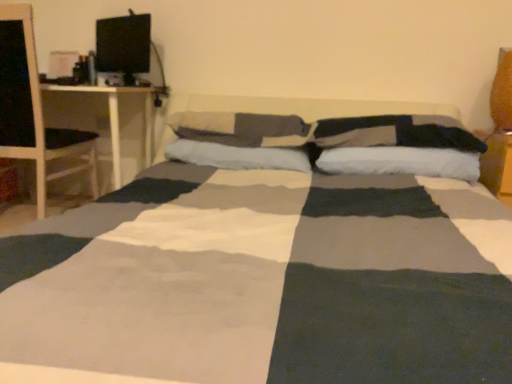
Question: Is white soft pillow at center, acting as the 2th pillow starting from the left, smaller than velvet orange pillow at upper right, the fifth pillow when ordered from left to right?

Choices:
 (A) no
 (B) yes

Answer: (A)

Question: Is velvet orange pillow at upper right, the 1th pillow from the right, at the back of white soft pillow at center, the fourth pillow when ordered from right to left?

Choices:
 (A) no
 (B) yes

Answer: (A)

Question: Is the depth of white soft pillow at center, acting as the 2th pillow starting from the left, greater than that of velvet orange pillow at upper right, the fifth pillow when ordered from left to right?

Choices:
 (A) yes
 (B) no

Answer: (B)

Question: Does white soft pillow at center, the fourth pillow when ordered from right to left, come in front of velvet orange pillow at upper right, the fifth pillow when ordered from left to right?

Choices:
 (A) no
 (B) yes

Answer: (B)

Question: Does white soft pillow at center, the fourth pillow when ordered from right to left, contain velvet orange pillow at upper right, the fifth pillow when ordered from left to right?

Choices:
 (A) yes
 (B) no

Answer: (B)

Question: In terms of size, does white soft pillow at center, which ranks as the second pillow in right-to-left order, appear bigger or smaller than dark gray fabric pillow at center, the third pillow positioned from the right?

Choices:
 (A) big
 (B) small

Answer: (B)

Question: Considering the positions of point (423, 168) and point (359, 125), is point (423, 168) closer or farther from the camera than point (359, 125)?

Choices:
 (A) farther
 (B) closer

Answer: (B)

Question: In the image, is white soft pillow at center, which ranks as the second pillow in right-to-left order, on the left side or the right side of dark gray fabric pillow at center, the third pillow positioned from the right?

Choices:
 (A) right
 (B) left

Answer: (A)

Question: In terms of width, does white soft pillow at center, the fourth pillow positioned from the left, look wider or thinner when compared to dark gray fabric pillow at center, the third pillow positioned from the right?

Choices:
 (A) wide
 (B) thin

Answer: (B)

Question: Considering the positions of white wood desk at left and wooden table at right in the image, is white wood desk at left taller or shorter than wooden table at right?

Choices:
 (A) short
 (B) tall

Answer: (B)

Question: From the image's perspective, is white wood desk at left located above or below wooden table at right?

Choices:
 (A) above
 (B) below

Answer: (A)

Question: Is white wood desk at left wider or thinner than wooden table at right?

Choices:
 (A) thin
 (B) wide

Answer: (B)

Question: Considering the positions of point (117, 185) and point (496, 178), is point (117, 185) closer or farther from the camera than point (496, 178)?

Choices:
 (A) farther
 (B) closer

Answer: (A)

Question: In terms of width, does wooden table at right look wider or thinner when compared to soft cotton pillow at center, which is the fifth pillow in right-to-left order?

Choices:
 (A) thin
 (B) wide

Answer: (B)

Question: Based on their sizes in the image, would you say wooden table at right is bigger or smaller than soft cotton pillow at center, the 1th pillow from the left?

Choices:
 (A) small
 (B) big

Answer: (B)